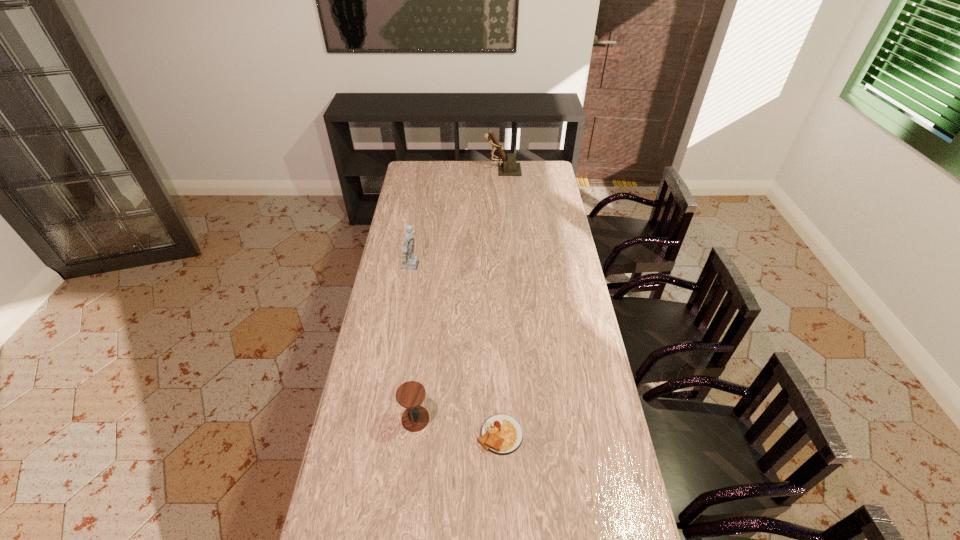
Identify which object is the third nearest to the hourglass. Please provide its 2D coordinates. Your answer should be formatted as a tuple, i.e. [(x, y)], where the tuple contains the x and y coordinates of a point satisfying the conditions above.

[(509, 167)]

You are a GUI agent. You are given a task and a screenshot of the screen. Output one action in this format:
    pyautogui.click(x=<x>, y=<y>)
    Task: Click on the vacant space that satisfies the following two spatial constraints: 1. on the front side of the omelet; 2. on the left side of the hourglass
    The height and width of the screenshot is (540, 960).
    Given the screenshot: What is the action you would take?
    pyautogui.click(x=414, y=434)

You are a GUI agent. You are given a task and a screenshot of the screen. Output one action in this format:
    pyautogui.click(x=<x>, y=<y>)
    Task: Click on the vacant space that satisfies the following two spatial constraints: 1. on the front-facing side of the third nearest object; 2. on the right side of the second shortest object
    The height and width of the screenshot is (540, 960).
    Given the screenshot: What is the action you would take?
    pyautogui.click(x=388, y=419)

I want to click on free region that satisfies the following two spatial constraints: 1. on the front-facing side of the nearer figurine; 2. on the left side of the third tallest object, so pos(388,419).

Where is `vacant space that satisfies the following two spatial constraints: 1. on the front-facing side of the right figurine; 2. on the front side of the shortest object`? The width and height of the screenshot is (960, 540). vacant space that satisfies the following two spatial constraints: 1. on the front-facing side of the right figurine; 2. on the front side of the shortest object is located at coordinates (521, 434).

I want to click on vacant space that satisfies the following two spatial constraints: 1. on the front-facing side of the farthest object; 2. on the front side of the hourglass, so click(520, 419).

In order to click on vacant position in the image that satisfies the following two spatial constraints: 1. on the front-facing side of the hourglass; 2. on the right side of the third nearest object in this screenshot , I will do `click(388, 419)`.

At what (x,y) coordinates should I click in order to perform the action: click on free point that satisfies the following two spatial constraints: 1. on the back side of the hourglass; 2. on the front-facing side of the left figurine. Please return your answer as a coordinate pair (x, y). This screenshot has width=960, height=540. Looking at the image, I should click on (433, 267).

Where is `vacant space that satisfies the following two spatial constraints: 1. on the front-facing side of the shortest object; 2. on the right side of the left figurine`? This screenshot has height=540, width=960. vacant space that satisfies the following two spatial constraints: 1. on the front-facing side of the shortest object; 2. on the right side of the left figurine is located at coordinates (386, 434).

Find the location of a particular element. free point that satisfies the following two spatial constraints: 1. on the front-facing side of the right figurine; 2. on the front side of the hourglass is located at coordinates (520, 419).